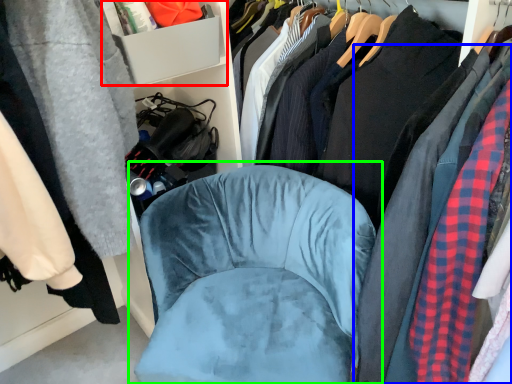
Question: Which object is positioned closest to cabinet (highlighted by a red box)? Select from clothing (highlighted by a blue box) and chair (highlighted by a green box).

Choices:
 (A) clothing
 (B) chair

Answer: (B)